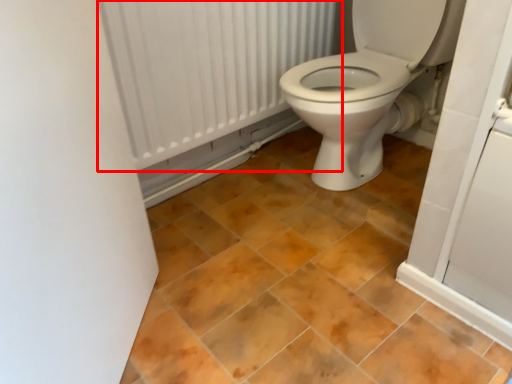
Question: In this image, where is radiator (annotated by the red box) located relative to ceramic tile?

Choices:
 (A) left
 (B) right

Answer: (A)